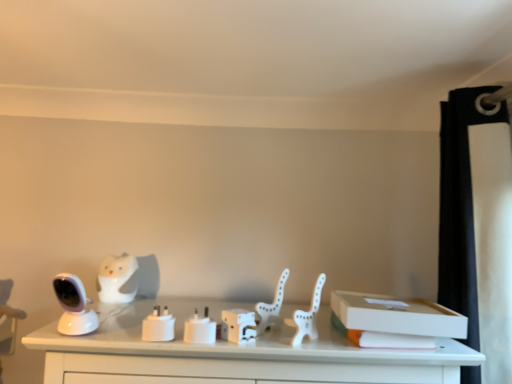
Question: From the image's perspective, would you say white plastic animal at center, which is the 1th animal from right to left, is positioned over white matte owl at left, marked as the first animal in a left-to-right arrangement?

Choices:
 (A) yes
 (B) no

Answer: (A)

Question: Is white plastic animal at center, the 2th animal when ordered from back to front, positioned with its back to white matte owl at left, marked as the first animal in a left-to-right arrangement?

Choices:
 (A) yes
 (B) no

Answer: (B)

Question: Is white plastic animal at center, the first animal positioned from the front, to the right of white matte owl at left, which is counted as the second animal, starting from the front, from the viewer's perspective?

Choices:
 (A) no
 (B) yes

Answer: (B)

Question: Can you confirm if white plastic animal at center, the first animal positioned from the front, is bigger than white matte owl at left, marked as the first animal in a left-to-right arrangement?

Choices:
 (A) no
 (B) yes

Answer: (A)

Question: From the image's perspective, does white plastic animal at center, which is the 1th animal from right to left, appear lower than white matte owl at left, which is counted as the second animal, starting from the front?

Choices:
 (A) no
 (B) yes

Answer: (A)

Question: Is white plastic animal at center, the 2th animal when ordered from back to front, positioned in front of white matte owl at left, placed as the 2th animal when sorted from right to left?

Choices:
 (A) no
 (B) yes

Answer: (B)

Question: From a real-world perspective, is white matte plastic chair at center on top of white cardboard box at right, the first box viewed from the right?

Choices:
 (A) no
 (B) yes

Answer: (B)

Question: Does white matte plastic chair at center have a greater width compared to white cardboard box at right, positioned as the 2th box in left-to-right order?

Choices:
 (A) no
 (B) yes

Answer: (A)

Question: From the image's perspective, does white matte plastic chair at center appear lower than white cardboard box at right, positioned as the 2th box in left-to-right order?

Choices:
 (A) no
 (B) yes

Answer: (A)

Question: Is white matte plastic chair at center to the left of white cardboard box at right, positioned as the 2th box in left-to-right order, from the viewer's perspective?

Choices:
 (A) yes
 (B) no

Answer: (A)

Question: Considering the relative sizes of white matte plastic chair at center and white cardboard box at right, positioned as the 2th box in left-to-right order, in the image provided, is white matte plastic chair at center smaller than white cardboard box at right, positioned as the 2th box in left-to-right order,?

Choices:
 (A) no
 (B) yes

Answer: (B)

Question: Is white matte plastic chair at center taller than white cardboard box at right, positioned as the 2th box in left-to-right order?

Choices:
 (A) yes
 (B) no

Answer: (A)

Question: Is white matte plastic chair at center oriented away from white plastic animal at center, which is the 1th animal from right to left?

Choices:
 (A) no
 (B) yes

Answer: (A)